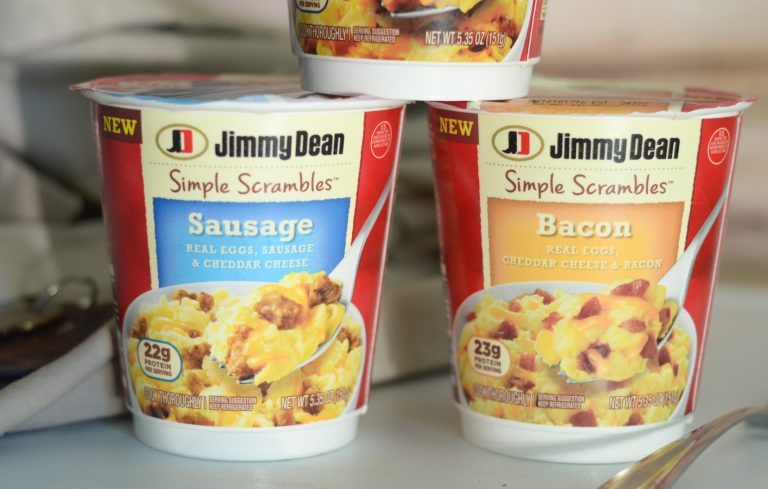
Locate an element on the screen. cup is located at coordinates (359, 217).